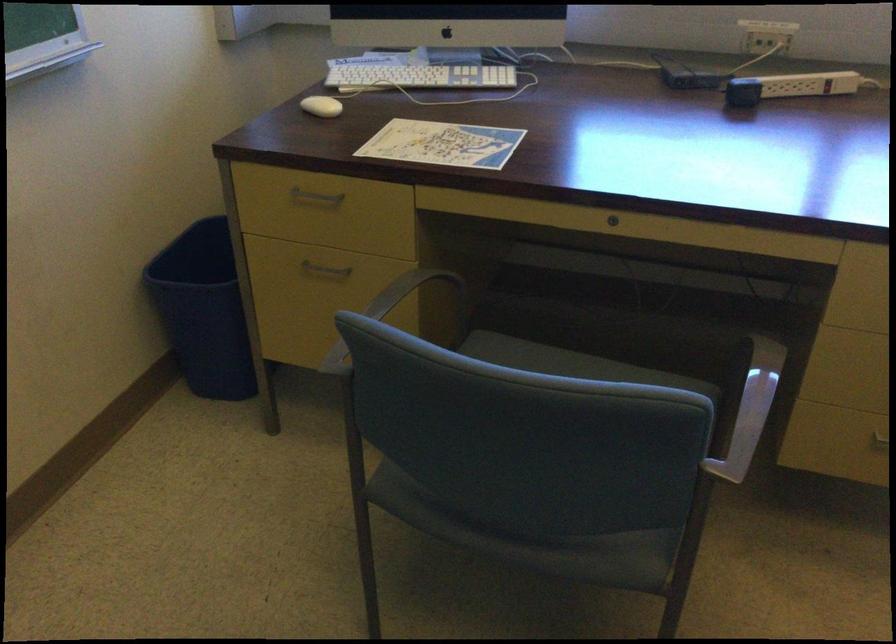
This screenshot has width=896, height=644. In order to click on blue chair sitting surface in this screenshot , I will do `click(538, 542)`.